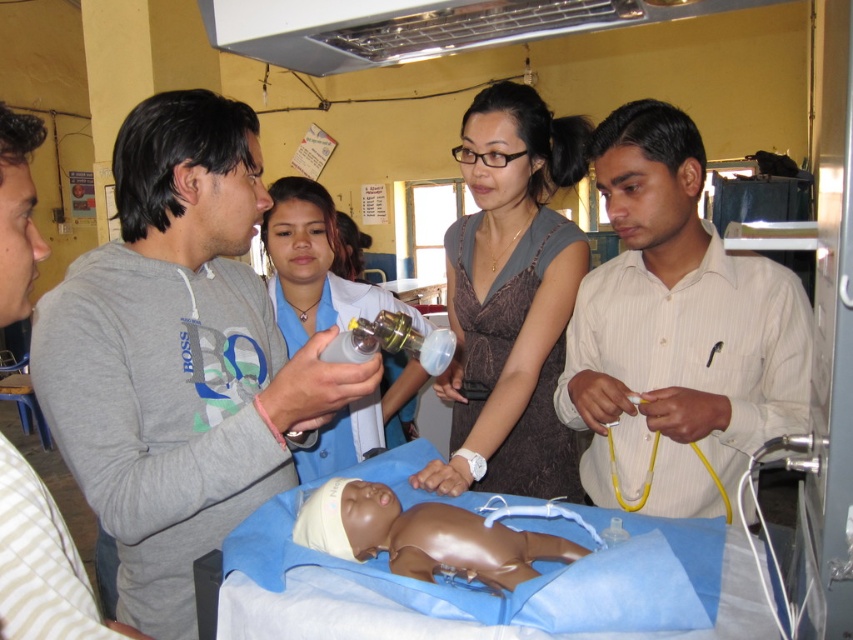
You are a medical student observing the training setup. You need to determine which object is taller between the gray cotton shirt at left and the smooth plastic baby at center. Which one is taller?

The gray cotton shirt at left is taller than the smooth plastic baby at center according to the description.

From the picture: You are a medical student standing in the training room and want to reach the gray cotton sweatshirt at center to retrieve a CPR manual from your pocket. Can you comfortably reach it without moving your position?

The gray cotton sweatshirt at center is 38.95 inches away from you, so you can comfortably reach it without moving your position.

You are a medical student observing a training session. You notice the gray cotton shirt at left and the smooth plastic baby at center. Which object is larger in size?

The gray cotton shirt at left is bigger than the smooth plastic baby at center according to the description.